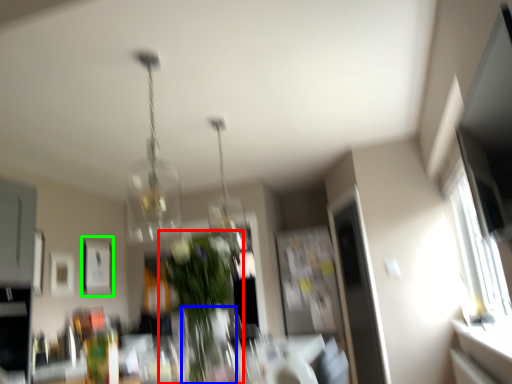
Question: Considering the real-world distances, which object is farthest from houseplant (highlighted by a red box)? glass vase (highlighted by a blue box) or picture frame (highlighted by a green box)?

Choices:
 (A) glass vase
 (B) picture frame

Answer: (B)